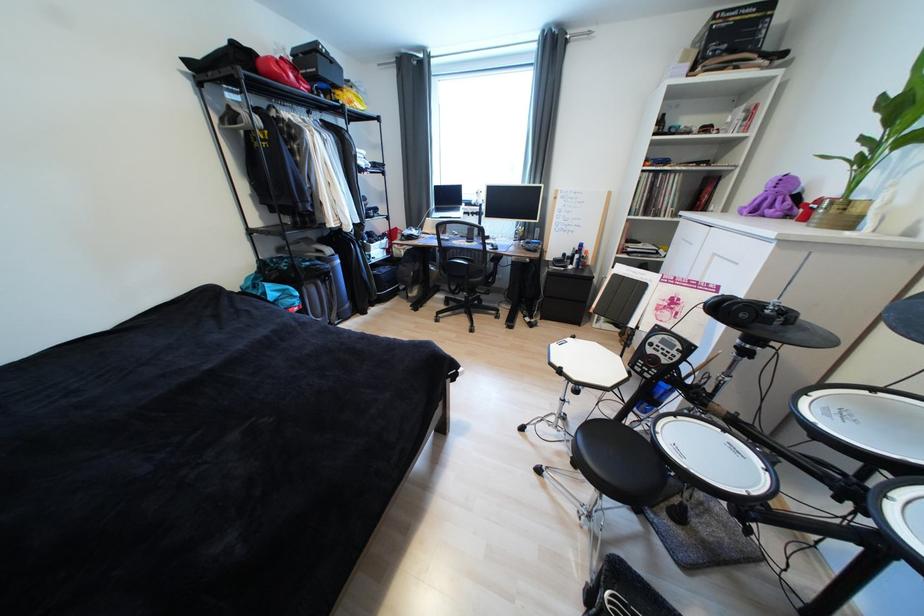
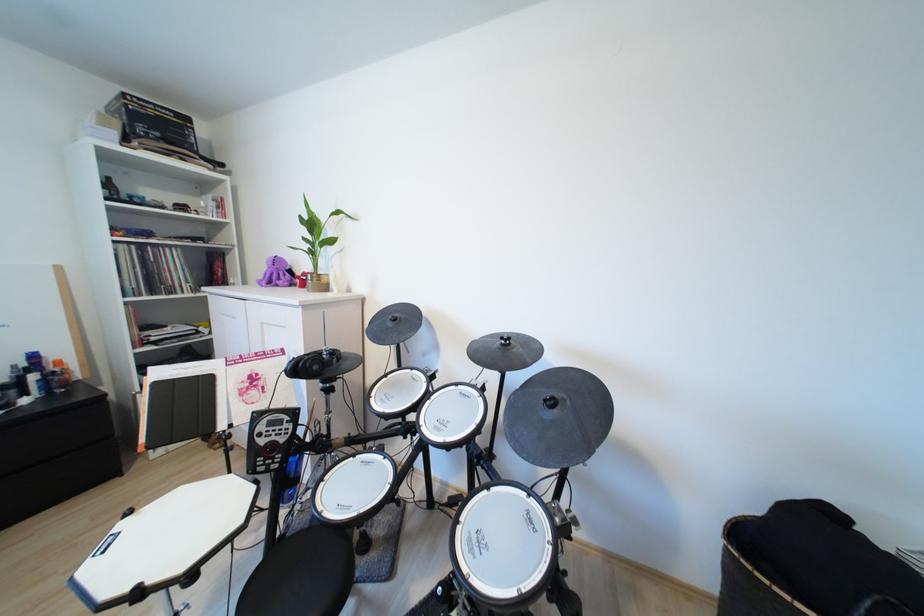
Find the pixel in the second image that matches pixel 749 315 in the first image.

(322, 369)